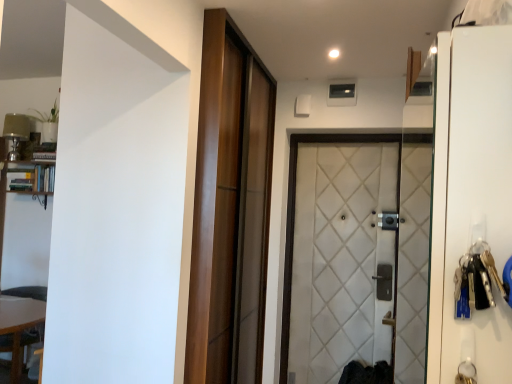
Question: Is wooden table at lower left surrounded by white quilted fabric door at center, arranged as the 2th door when viewed from the left?

Choices:
 (A) no
 (B) yes

Answer: (A)

Question: Is white quilted fabric door at center, the 1th door viewed from the right, not within wooden table at lower left?

Choices:
 (A) yes
 (B) no

Answer: (A)

Question: From the image's perspective, does white quilted fabric door at center, the 1th door viewed from the right, appear lower than wooden table at lower left?

Choices:
 (A) no
 (B) yes

Answer: (A)

Question: Are white quilted fabric door at center, arranged as the 2th door when viewed from the left, and wooden table at lower left located far from each other?

Choices:
 (A) no
 (B) yes

Answer: (B)

Question: Considering the relative sizes of white quilted fabric door at center, arranged as the 2th door when viewed from the left, and wooden table at lower left in the image provided, is white quilted fabric door at center, arranged as the 2th door when viewed from the left, thinner than wooden table at lower left?

Choices:
 (A) no
 (B) yes

Answer: (B)

Question: Is point (214, 299) closer or farther from the camera than point (39, 193)?

Choices:
 (A) farther
 (B) closer

Answer: (B)

Question: Relative to wooden bookshelf at left, is wooden sliding door at center, the first door positioned from the left, in front or behind?

Choices:
 (A) behind
 (B) front

Answer: (B)

Question: Considering the positions of wooden sliding door at center, the first door positioned from the left, and wooden bookshelf at left in the image, is wooden sliding door at center, the first door positioned from the left, taller or shorter than wooden bookshelf at left?

Choices:
 (A) short
 (B) tall

Answer: (B)

Question: From the image's perspective, is wooden sliding door at center, arranged as the 2th door when viewed from the right, above or below wooden bookshelf at left?

Choices:
 (A) below
 (B) above

Answer: (A)

Question: Is white quilted fabric door at center, the 1th door viewed from the right, taller or shorter than white glossy screen door at right?

Choices:
 (A) tall
 (B) short

Answer: (A)

Question: Choose the correct answer: Is white quilted fabric door at center, arranged as the 2th door when viewed from the left, inside white glossy screen door at right or outside it?

Choices:
 (A) inside
 (B) outside

Answer: (B)

Question: From the image's perspective, is white quilted fabric door at center, the 1th door viewed from the right, located above or below white glossy screen door at right?

Choices:
 (A) above
 (B) below

Answer: (B)

Question: Looking at the image, does white quilted fabric door at center, the 1th door viewed from the right, seem bigger or smaller compared to white glossy screen door at right?

Choices:
 (A) small
 (B) big

Answer: (B)

Question: Does point (292, 244) appear closer or farther from the camera than point (34, 319)?

Choices:
 (A) farther
 (B) closer

Answer: (A)

Question: Considering their positions, is white quilted fabric door at center, the 1th door viewed from the right, located in front of or behind wooden table at lower left?

Choices:
 (A) behind
 (B) front

Answer: (A)